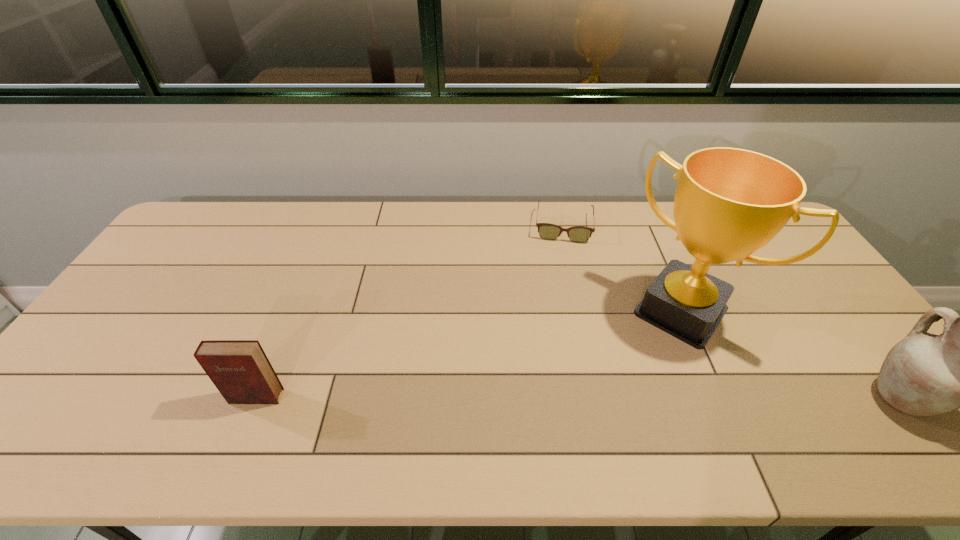
This screenshot has height=540, width=960. Identify the location of vacant space located at the front view of the farthest object. (561, 282).

In order to click on free space located at the front view of the farthest object in this screenshot , I will do `click(560, 308)`.

The width and height of the screenshot is (960, 540). What are the coordinates of `object that is positioned at the far edge` in the screenshot? It's located at (579, 234).

The height and width of the screenshot is (540, 960). I want to click on object that is positioned at the near edge, so click(240, 370).

Where is `vacant space at the far edge of the desktop`? vacant space at the far edge of the desktop is located at coordinates (421, 222).

Identify the location of vacant space at the near edge of the desktop. (342, 411).

Find the location of a particular element. This screenshot has width=960, height=540. vacant space at the right edge is located at coordinates (804, 291).

The image size is (960, 540). In order to click on vacant space in between the diary and the second farthest object in this screenshot , I will do `click(468, 354)`.

This screenshot has width=960, height=540. I want to click on vacant area between the tallest object and the third object from right to left, so click(x=622, y=269).

This screenshot has height=540, width=960. I want to click on vacant space in between the spectacles and the leftmost object, so click(x=410, y=312).